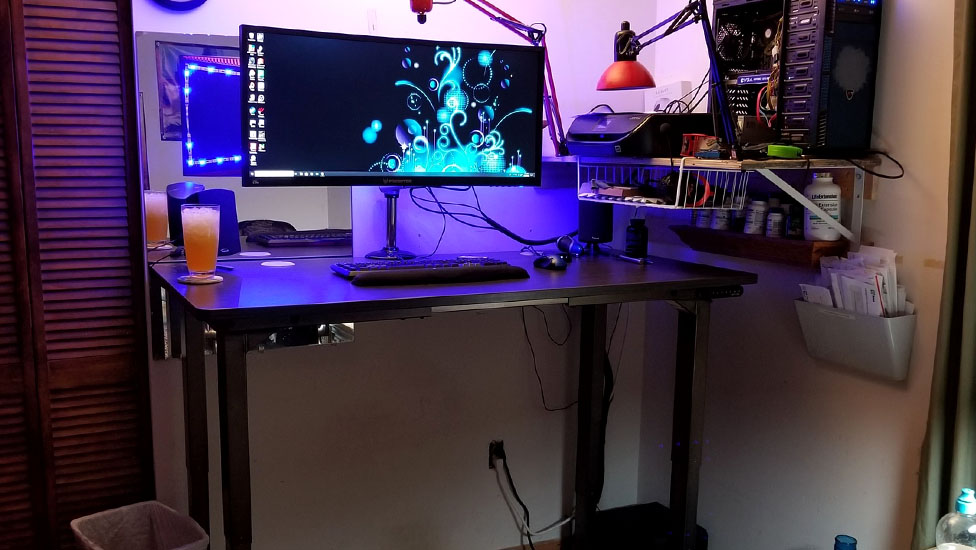
This screenshot has width=976, height=550. Identify the location of trash can. [120, 532].